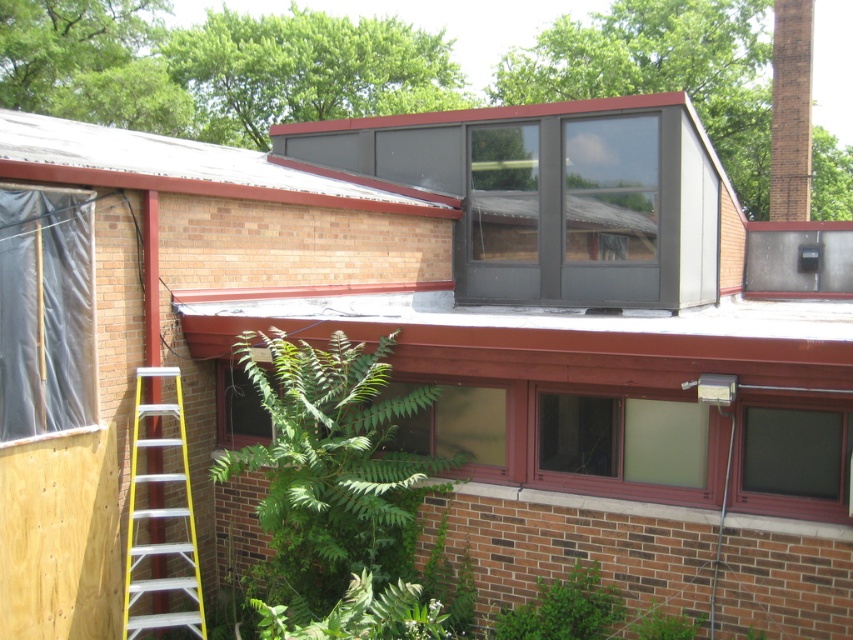
Question: Which of the following is the farthest from the observer?

Choices:
 (A) brown brick chimney at upper right
 (B) green leafy fern at lower center
 (C) clear glass window at center

Answer: (A)

Question: Which object is positioned closest to the clear glass window at center?

Choices:
 (A) green leafy plant at lower right
 (B) brown brick chimney at upper right
 (C) green leafy fern at lower center
 (D) green leafy plant at lower center

Answer: (D)

Question: Is smooth gray roof at upper center thinner than transparent glass window at center?

Choices:
 (A) yes
 (B) no

Answer: (B)

Question: Which point is closer to the camera?

Choices:
 (A) smooth gray roof at upper center
 (B) green leafy plant at lower right

Answer: (A)

Question: Can you confirm if transparent glass window at center is positioned to the right of green leafy plant at lower right?

Choices:
 (A) yes
 (B) no

Answer: (B)

Question: From the image, what is the correct spatial relationship of clear glass window at center in relation to green leafy plant at lower right?

Choices:
 (A) above
 (B) below

Answer: (A)